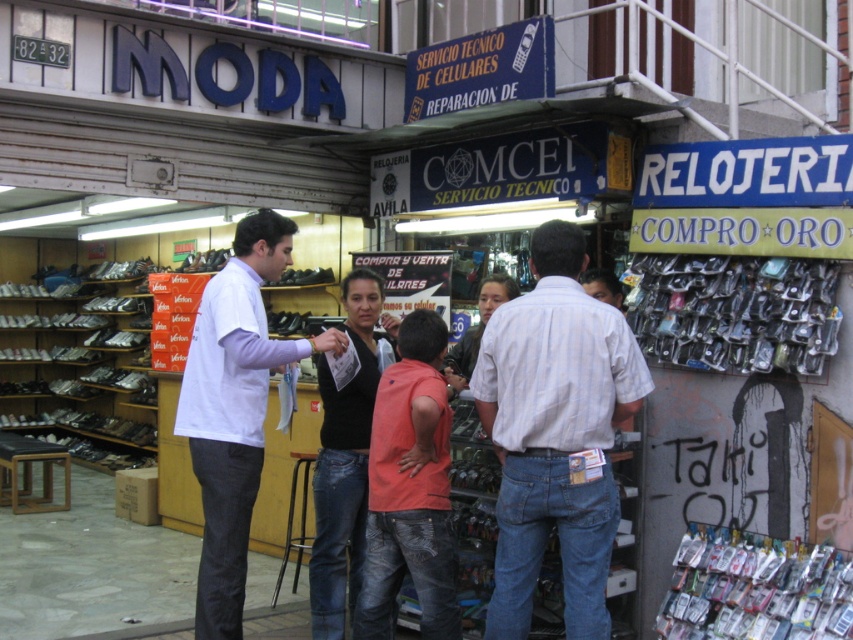
Question: Which of the following is the farthest from the observer?

Choices:
 (A) white cotton shirt at center
 (B) striped cotton shirt at center

Answer: (A)

Question: Does striped cotton shirt at center appear on the left side of black matte shirt at center?

Choices:
 (A) no
 (B) yes

Answer: (A)

Question: Does striped cotton shirt at center appear on the left side of white cotton shirt at center?

Choices:
 (A) yes
 (B) no

Answer: (B)

Question: Which point is closer to the camera?

Choices:
 (A) (386, 330)
 (B) (494, 301)
 (C) (260, 330)

Answer: (C)

Question: Is striped cotton shirt at center positioned in front of black matte shirt at center?

Choices:
 (A) no
 (B) yes

Answer: (B)

Question: Among these points, which one is farthest from the camera?

Choices:
 (A) (364, 417)
 (B) (467, 372)
 (C) (223, 513)
 (D) (492, 406)

Answer: (B)